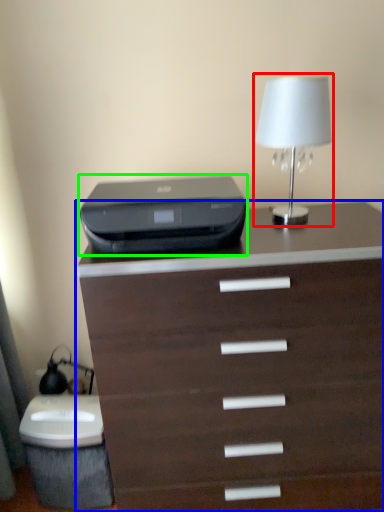
Question: Considering the real-world distances, which object is closest to table lamp (highlighted by a red box)? chest of drawers (highlighted by a blue box) or printer (highlighted by a green box).

Choices:
 (A) chest of drawers
 (B) printer

Answer: (B)